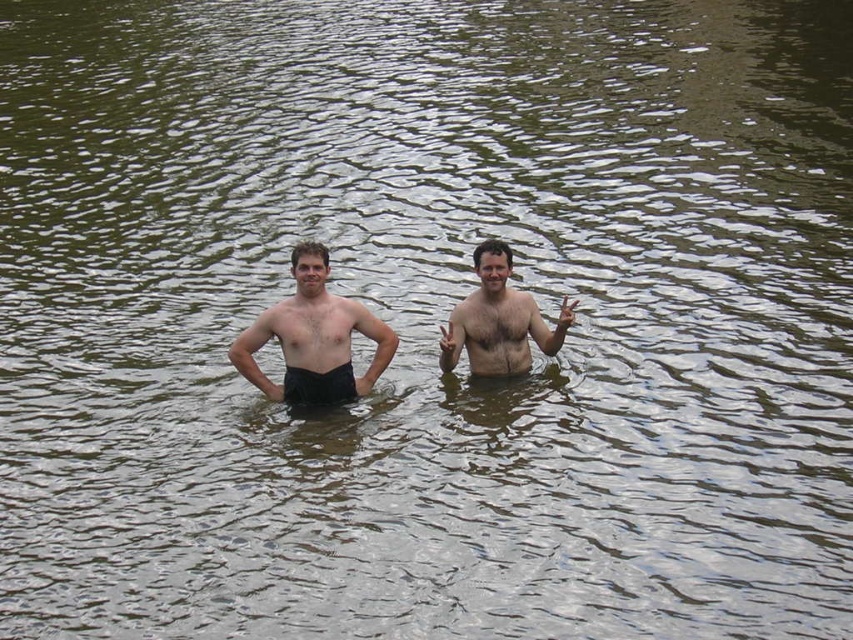
In the scene shown: You are a photographer trying to capture a closeup of the smooth skin couple at center and the black cotton shorts at center. Since you want to focus on the couple, which object should you zoom in on more?

The smooth skin couple at center is smaller than the black cotton shorts at center, so to focus on them, you should zoom in on the smooth skin couple at center more.